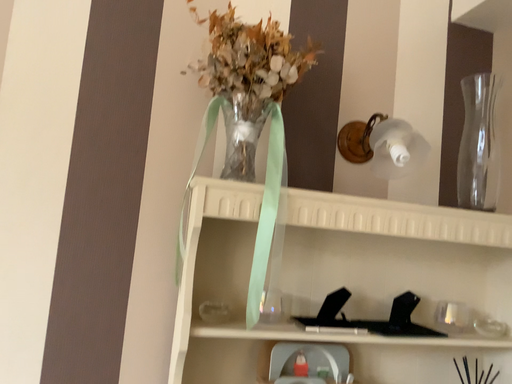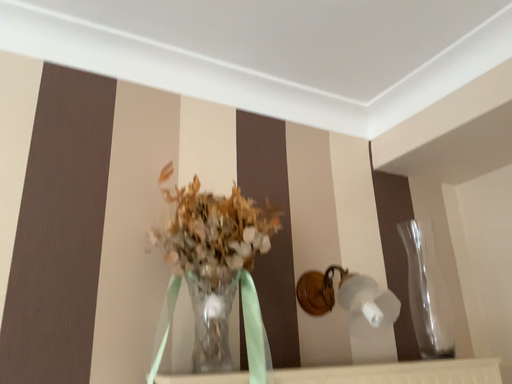
Question: How did the camera likely rotate when shooting the video?

Choices:
 (A) rotated upward
 (B) rotated downward

Answer: (A)